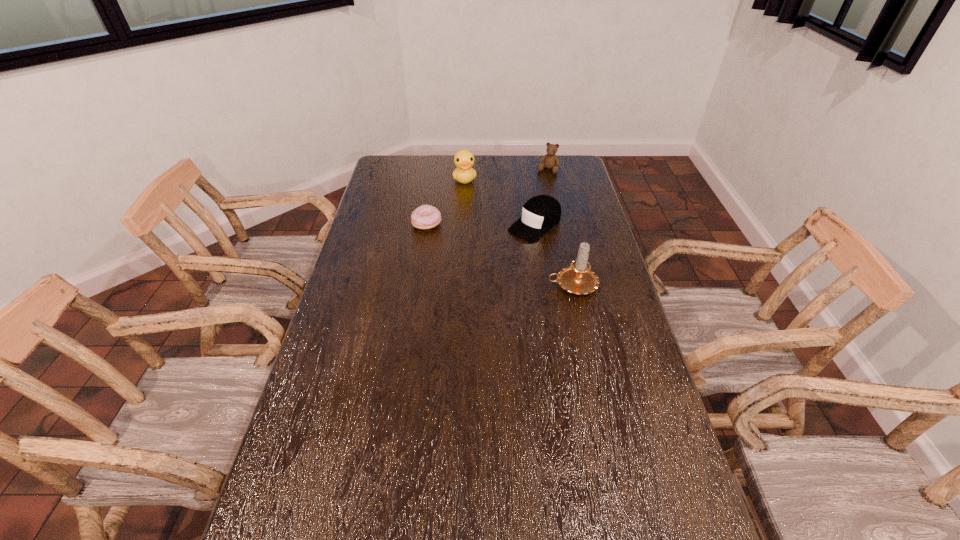
Where is `free space between the shortest object and the teddy bear`? The height and width of the screenshot is (540, 960). free space between the shortest object and the teddy bear is located at coordinates (487, 197).

Locate an element on the screen. free spot between the duck and the shortest object is located at coordinates (445, 201).

Find the location of a particular element. vacant space in between the fourth shortest object and the teddy bear is located at coordinates (506, 174).

The height and width of the screenshot is (540, 960). Identify the location of free space between the doughnut and the third tallest object. (487, 197).

This screenshot has width=960, height=540. I want to click on vacant area that lies between the fourth tallest object and the tallest object, so coord(554,255).

Find the location of a particular element. The width and height of the screenshot is (960, 540). vacant point located between the fourth object from right to left and the fourth tallest object is located at coordinates (500, 202).

This screenshot has width=960, height=540. In order to click on free area in between the cap and the second tallest object in this screenshot , I will do point(500,202).

In order to click on free space between the leftmost object and the tallest object in this screenshot , I will do `click(499, 254)`.

Where is `object that stands as the fourth closest to the fourth object from right to left`? object that stands as the fourth closest to the fourth object from right to left is located at coordinates (578, 278).

This screenshot has width=960, height=540. I want to click on object that can be found as the second closest to the cap, so click(x=464, y=173).